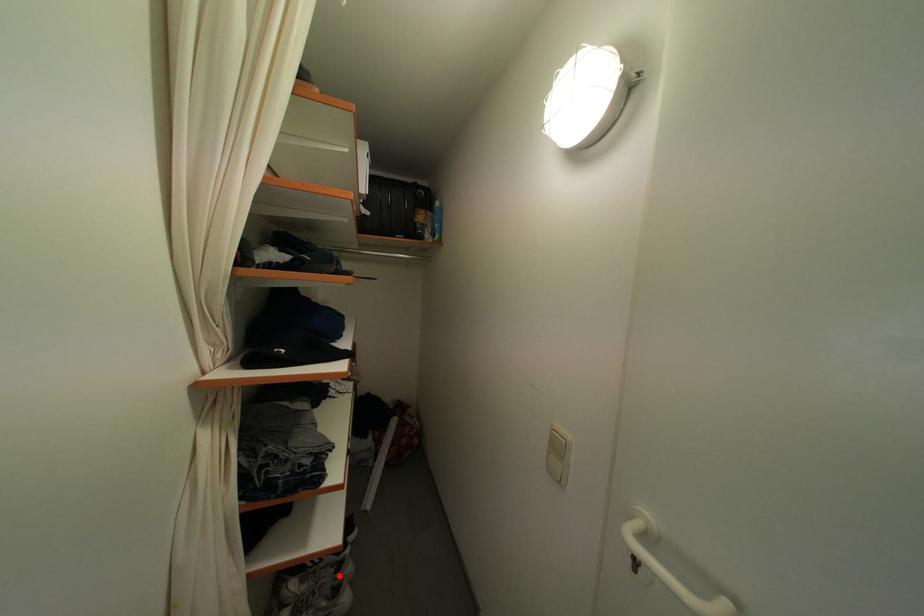
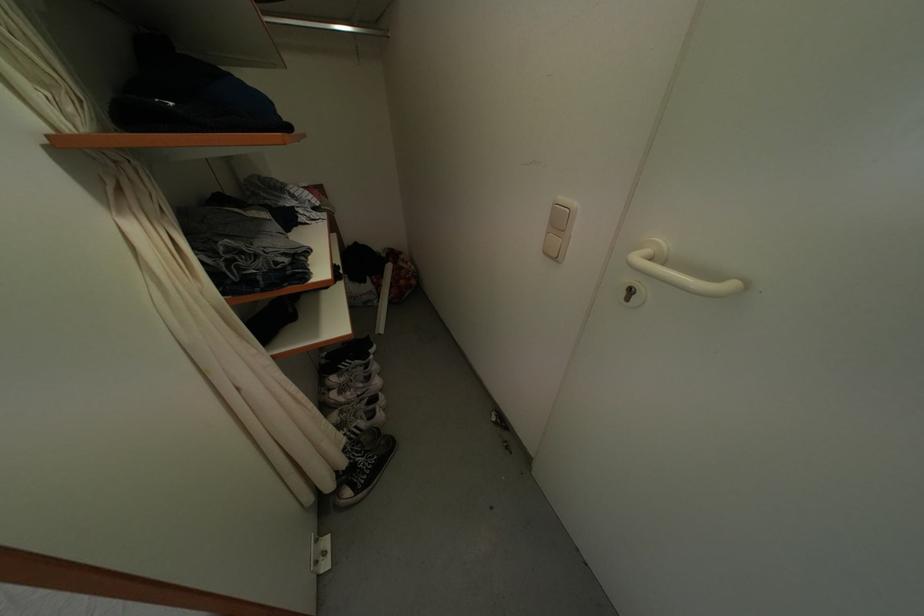
Question: I am providing you with two images of the same scene from different viewpoints. In image1, a red point is highlighted. Considering the same 3D point in image2, which of the following is correct?

Choices:
 (A) It is closer
 (B) It is farther

Answer: (A)